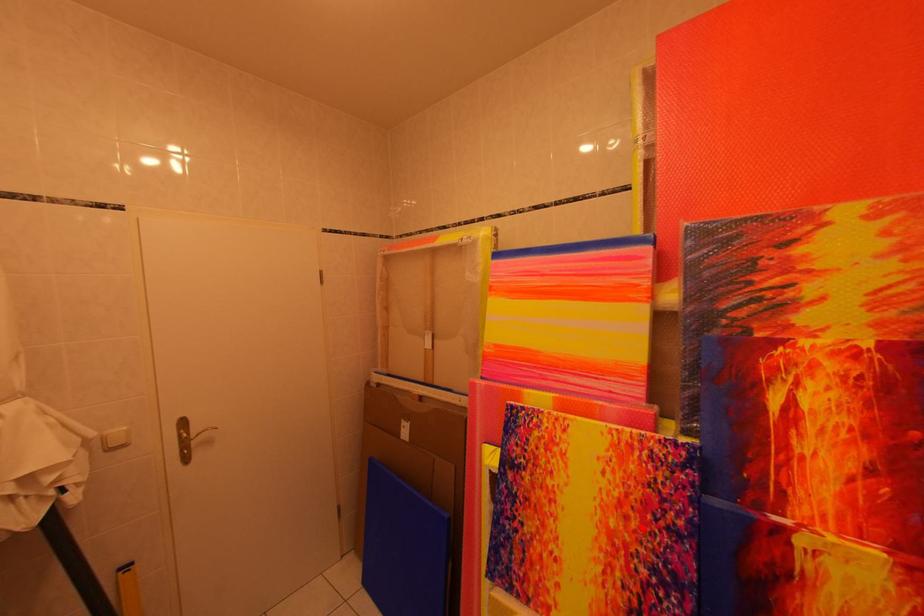
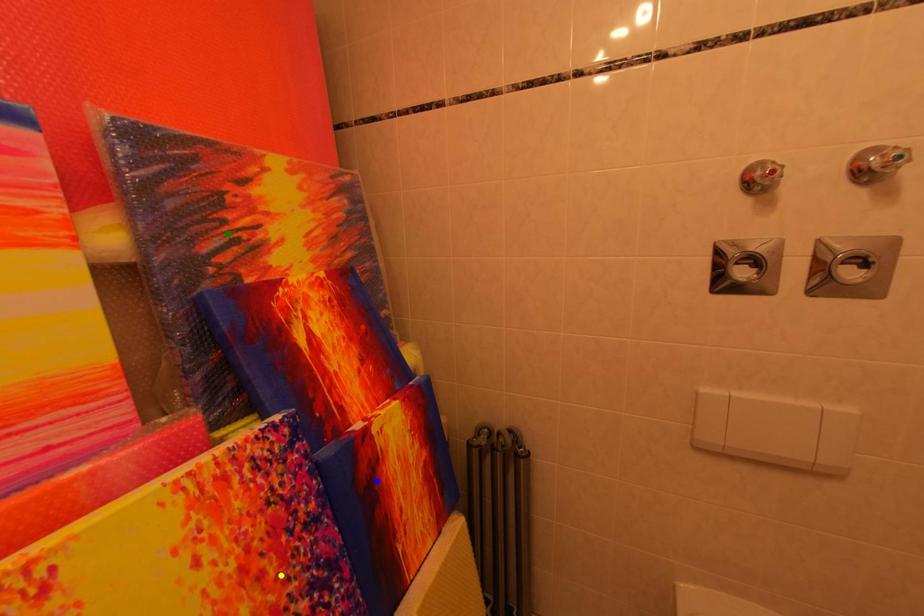
Question: I am providing you with two images of the same scene from different viewpoints. A red point is marked on the first image. You are given multiple points on the second image. Which mark in image 2 goes with the point in image 1?

Choices:
 (A) green point
 (B) yellow point
 (C) blue point

Answer: (B)